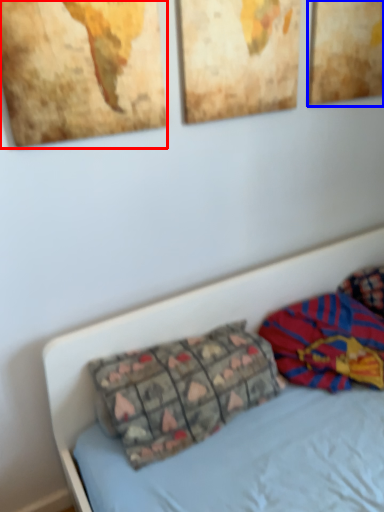
Question: Which object is closer to the camera taking this photo, picture frame (highlighted by a red box) or picture frame (highlighted by a blue box)?

Choices:
 (A) picture frame
 (B) picture frame

Answer: (A)